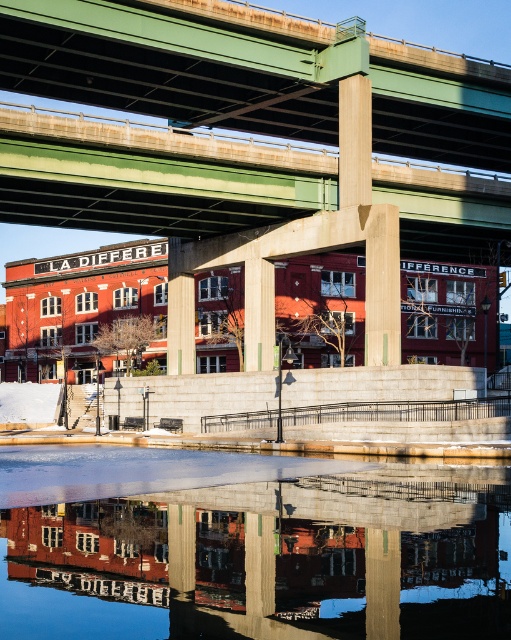
You are standing on the sidewalk and see the transparent glass water at center and the green concrete bridge at center. Which one is more to the left?

The transparent glass water at center is positioned on the left side of green concrete bridge at center, so it is more to the left.

You are standing at the point marked as point (248, 547). What object are you standing on?

You are standing on transparent glass water at center located at point (248, 547).

You are a delivery drone that needs to pass through the space between the transparent glass water at center and the green concrete bridge at center. The drone is 0.5 meters thick. Can it safely pass through the space?

The transparent glass water at center is thinner than the green concrete bridge at center. However, the description does not provide specific measurements of the space between them. Without knowing the exact width of the gap, it is impossible to determine if the drone can safely pass through.